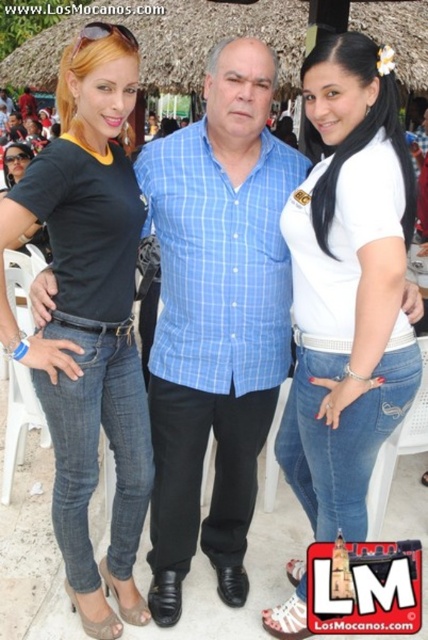
Question: In this image, where is white matte shirt at center located relative to matte black shirt at left?

Choices:
 (A) left
 (B) right

Answer: (B)

Question: Does white matte shirt at center appear over matte black shirt at left?

Choices:
 (A) no
 (B) yes

Answer: (B)

Question: Can you confirm if blue checkered shirt at center is thinner than matte black shirt at left?

Choices:
 (A) yes
 (B) no

Answer: (B)

Question: Which point is farther to the camera?

Choices:
 (A) (112, 237)
 (B) (332, 330)

Answer: (A)

Question: Which point appears farthest from the camera in this image?

Choices:
 (A) (288, 241)
 (B) (130, 362)

Answer: (B)

Question: Among these objects, which one is nearest to the camera?

Choices:
 (A) blue checkered shirt at center
 (B) matte black shirt at left

Answer: (B)